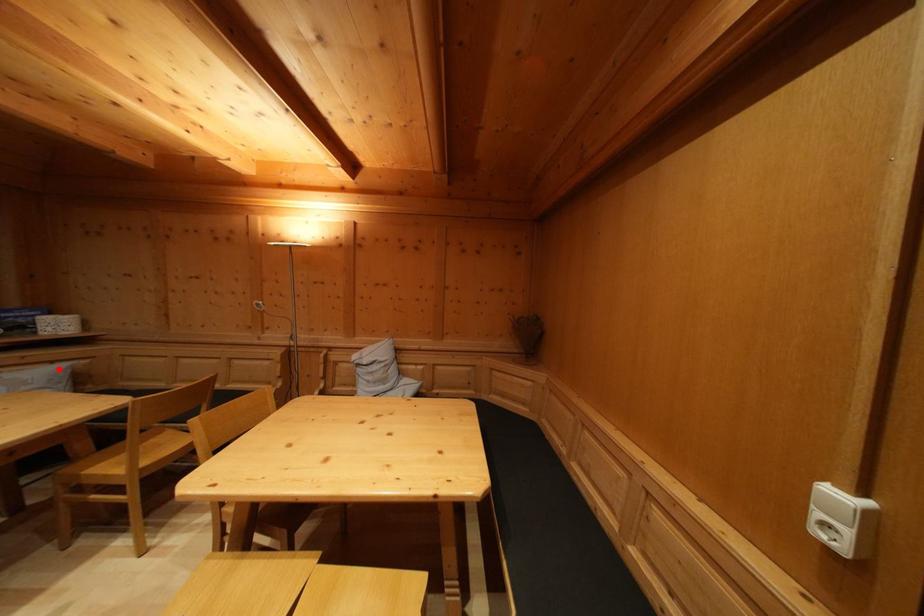
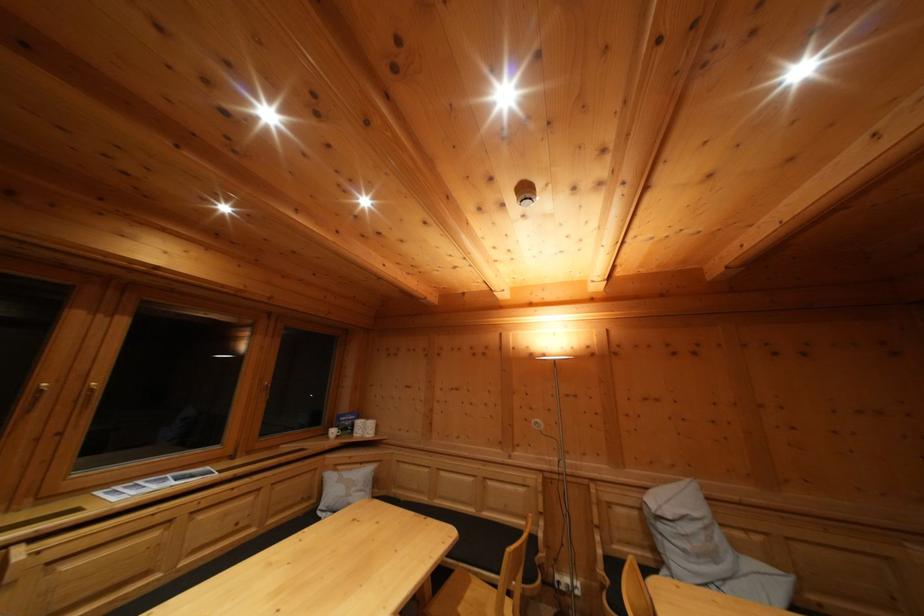
Question: I am providing you with two images of the same scene from different viewpoints. Given a red point in image1, look at the same physical point in image2. Is it:

Choices:
 (A) Closer to the viewpoint
 (B) Farther from the viewpoint

Answer: (B)